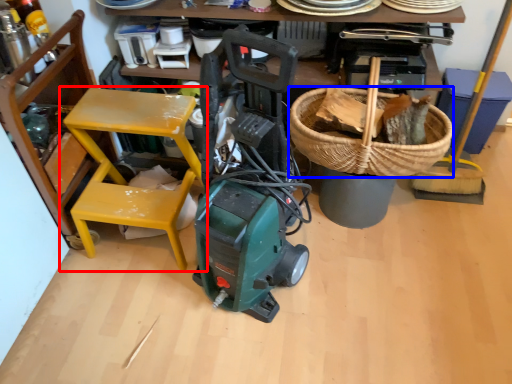
Question: Among these objects, which one is farthest to the camera, chair (highlighted by a red box) or basket (highlighted by a blue box)?

Choices:
 (A) chair
 (B) basket

Answer: (B)